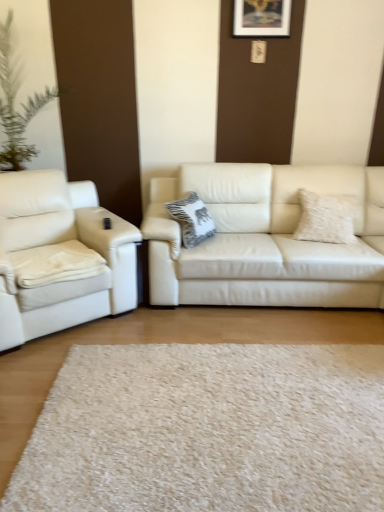
Locate an element on the screen. The height and width of the screenshot is (512, 384). matte white couch at left, the 1th studio couch viewed from the left is located at coordinates (59, 256).

This screenshot has height=512, width=384. Find the location of `matte white couch at center, acting as the first studio couch starting from the right`. matte white couch at center, acting as the first studio couch starting from the right is located at coordinates (265, 239).

Is fuzzy white pillow at right, the first pillow positioned from the right, located outside white textured pillow at center, the 1th pillow when ordered from left to right?

That's correct, fuzzy white pillow at right, the first pillow positioned from the right, is outside of white textured pillow at center, the 1th pillow when ordered from left to right.

Does point (349, 240) lie behind point (198, 202)?

No, (349, 240) is closer to viewer.

Locate an element on the screen. The width and height of the screenshot is (384, 512). pillow located above the white textured pillow at center, the 1th pillow when ordered from left to right (from the image's perspective) is located at coordinates (326, 217).

From the image's perspective, relative to white textured pillow at center, the 1th pillow when ordered from left to right, is fuzzy white pillow at right, the first pillow positioned from the right, above or below?

Clearly, from the image's perspective, fuzzy white pillow at right, the first pillow positioned from the right, is above white textured pillow at center, the 1th pillow when ordered from left to right.

How many degrees apart are the facing directions of matte white couch at center, acting as the second studio couch starting from the left, and wooden picture frame at upper center?

The facing directions of matte white couch at center, acting as the second studio couch starting from the left, and wooden picture frame at upper center are 1.22 degrees apart.

Between matte white couch at center, acting as the second studio couch starting from the left, and wooden picture frame at upper center, which one has larger width?

matte white couch at center, acting as the second studio couch starting from the left.

Could you tell me if matte white couch at center, acting as the second studio couch starting from the left, is turned towards wooden picture frame at upper center?

No.

Who is bigger, matte white couch at center, acting as the first studio couch starting from the right, or wooden picture frame at upper center?

With larger size is matte white couch at center, acting as the first studio couch starting from the right.

From the image's perspective, which studio couch is the 1st one below the wooden picture frame at upper center? Please provide its 2D coordinates.

[(265, 239)]

Is wooden picture frame at upper center at the right side of matte white couch at center, acting as the second studio couch starting from the left?

Correct, you'll find wooden picture frame at upper center to the right of matte white couch at center, acting as the second studio couch starting from the left.

Considering the sizes of objects wooden picture frame at upper center and matte white couch at center, acting as the second studio couch starting from the left, in the image provided, who is thinner, wooden picture frame at upper center or matte white couch at center, acting as the second studio couch starting from the left,?

wooden picture frame at upper center.

Could you measure the distance between wooden picture frame at upper center and white textured pillow at center, placed as the 2th pillow when sorted from right to left?

They are 1.37 meters apart.

Visually, is wooden picture frame at upper center positioned to the left or to the right of white textured pillow at center, placed as the 2th pillow when sorted from right to left?

wooden picture frame at upper center is to the right of white textured pillow at center, placed as the 2th pillow when sorted from right to left.

Which object is further away from the camera, wooden picture frame at upper center or white textured pillow at center, placed as the 2th pillow when sorted from right to left?

wooden picture frame at upper center.

Considering the sizes of white textured pillow at center, placed as the 2th pillow when sorted from right to left, and white shag rug at center in the image, is white textured pillow at center, placed as the 2th pillow when sorted from right to left, bigger or smaller than white shag rug at center?

Considering their sizes, white textured pillow at center, placed as the 2th pillow when sorted from right to left, takes up less space than white shag rug at center.

Considering the sizes of white textured pillow at center, the 1th pillow when ordered from left to right, and white shag rug at center in the image, is white textured pillow at center, the 1th pillow when ordered from left to right, taller or shorter than white shag rug at center?

Considering their sizes, white textured pillow at center, the 1th pillow when ordered from left to right, has more height than white shag rug at center.

From the white shag rug at center, count 1st pillows backward and point to it. Please provide its 2D coordinates.

[(192, 219)]

From a real-world perspective, is white textured pillow at center, placed as the 2th pillow when sorted from right to left, located beneath matte white couch at left, the 2th studio couch in the right-to-left sequence?

Incorrect, from a real-world perspective, white textured pillow at center, placed as the 2th pillow when sorted from right to left, is higher than matte white couch at left, the 2th studio couch in the right-to-left sequence.

Considering the relative positions of white textured pillow at center, placed as the 2th pillow when sorted from right to left, and matte white couch at left, the 1th studio couch viewed from the left, in the image provided, is white textured pillow at center, placed as the 2th pillow when sorted from right to left, in front of matte white couch at left, the 1th studio couch viewed from the left,?

No, white textured pillow at center, placed as the 2th pillow when sorted from right to left, is further to the viewer.

Is white textured pillow at center, the 1th pillow when ordered from left to right, not inside matte white couch at left, the 1th studio couch viewed from the left?

Absolutely, white textured pillow at center, the 1th pillow when ordered from left to right, is external to matte white couch at left, the 1th studio couch viewed from the left.

Is white textured pillow at center, placed as the 2th pillow when sorted from right to left, positioned with its back to matte white couch at left, the 2th studio couch in the right-to-left sequence?

No, white textured pillow at center, placed as the 2th pillow when sorted from right to left, is not facing the opposite direction of matte white couch at left, the 2th studio couch in the right-to-left sequence.

Does point (78, 455) lie behind point (200, 219)?

No.

Which of these two, white shag rug at center or white textured pillow at center, the 1th pillow when ordered from left to right, is thinner?

With smaller width is white textured pillow at center, the 1th pillow when ordered from left to right.

I want to click on plain below the white textured pillow at center, placed as the 2th pillow when sorted from right to left (from a real-world perspective), so click(x=208, y=430).

Is white shag rug at center inside or outside of white textured pillow at center, the 1th pillow when ordered from left to right?

white shag rug at center lies outside white textured pillow at center, the 1th pillow when ordered from left to right.

Identify the location of pillow in front of the fuzzy white pillow at right, acting as the second pillow starting from the left. (192, 219).

You are a GUI agent. You are given a task and a screenshot of the screen. Output one action in this format:
    pyautogui.click(x=<x>, y=<y>)
    Task: Click on the picture frame behind the matte white couch at center, acting as the first studio couch starting from the right
    The width and height of the screenshot is (384, 512).
    Given the screenshot: What is the action you would take?
    pyautogui.click(x=261, y=18)

When comparing their distances from white shag rug at center, does matte white couch at left, the 2th studio couch in the right-to-left sequence, or fuzzy white pillow at right, acting as the second pillow starting from the left, seem further?

fuzzy white pillow at right, acting as the second pillow starting from the left, lies further to white shag rug at center than the other object.

Estimate the real-world distances between objects in this image. Which object is further from matte white couch at center, acting as the first studio couch starting from the right, fuzzy white pillow at right, the first pillow positioned from the right, or wooden picture frame at upper center?

wooden picture frame at upper center.

Estimate the real-world distances between objects in this image. Which object is further from matte white couch at center, acting as the second studio couch starting from the left, white shag rug at center or white textured pillow at center, placed as the 2th pillow when sorted from right to left?

white shag rug at center is further to matte white couch at center, acting as the second studio couch starting from the left.

From the image, which object appears to be farther from white shag rug at center, white textured pillow at center, the 1th pillow when ordered from left to right, or wooden picture frame at upper center?

The object further to white shag rug at center is wooden picture frame at upper center.

Looking at the image, which one is located closer to wooden picture frame at upper center, matte white couch at center, acting as the first studio couch starting from the right, or matte white couch at left, the 1th studio couch viewed from the left?

matte white couch at center, acting as the first studio couch starting from the right, is positioned closer to the anchor wooden picture frame at upper center.

Based on their spatial positions, is fuzzy white pillow at right, acting as the second pillow starting from the left, or matte white couch at left, the 1th studio couch viewed from the left, further from wooden picture frame at upper center?

matte white couch at left, the 1th studio couch viewed from the left, is further to wooden picture frame at upper center.

When comparing their distances from white textured pillow at center, placed as the 2th pillow when sorted from right to left, does white shag rug at center or matte white couch at center, acting as the second studio couch starting from the left, seem further?

The object further to white textured pillow at center, placed as the 2th pillow when sorted from right to left, is white shag rug at center.

From the image, which object appears to be farther from wooden picture frame at upper center, white shag rug at center or matte white couch at center, acting as the first studio couch starting from the right?

white shag rug at center.

Identify the location of plain between matte white couch at left, the 2th studio couch in the right-to-left sequence, and matte white couch at center, acting as the first studio couch starting from the right, from left to right. The image size is (384, 512). (208, 430).

Where is `pillow situated between matte white couch at left, the 2th studio couch in the right-to-left sequence, and fuzzy white pillow at right, the first pillow positioned from the right, from left to right`? This screenshot has width=384, height=512. pillow situated between matte white couch at left, the 2th studio couch in the right-to-left sequence, and fuzzy white pillow at right, the first pillow positioned from the right, from left to right is located at coordinates (192, 219).

You are a GUI agent. You are given a task and a screenshot of the screen. Output one action in this format:
    pyautogui.click(x=<x>, y=<y>)
    Task: Click on the pillow between white shag rug at center and fuzzy white pillow at right, the first pillow positioned from the right, from front to back
    
    Given the screenshot: What is the action you would take?
    pyautogui.click(x=192, y=219)

Image resolution: width=384 pixels, height=512 pixels. I want to click on pillow between wooden picture frame at upper center and white textured pillow at center, placed as the 2th pillow when sorted from right to left, in the up-down direction, so click(x=326, y=217).